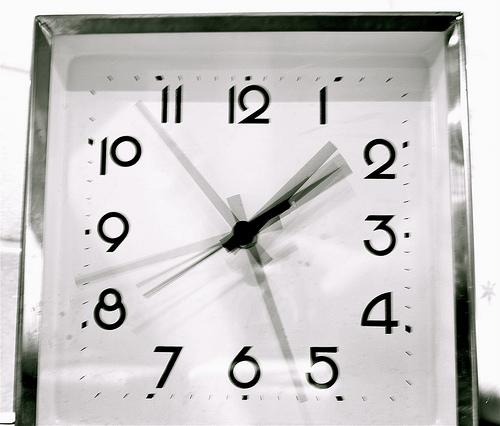
Find the location of a particular element. silver frame is located at coordinates (155, 23).